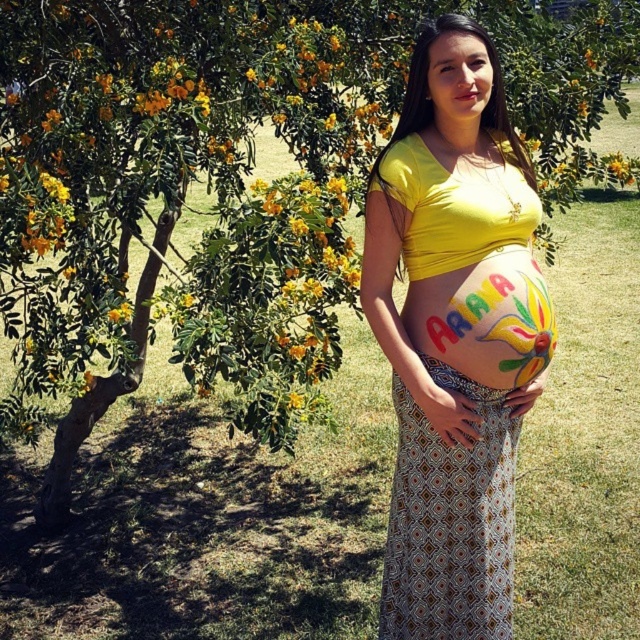
The width and height of the screenshot is (640, 640). In order to click on patterned fabric dress at center in this screenshot , I will do 451,520.

Is patterned fabric dress at center above painted colorful belly at center?

Incorrect, patterned fabric dress at center is not positioned above painted colorful belly at center.

The image size is (640, 640). What do you see at coordinates (451, 520) in the screenshot?
I see `patterned fabric dress at center` at bounding box center [451, 520].

You are a GUI agent. You are given a task and a screenshot of the screen. Output one action in this format:
    pyautogui.click(x=<x>, y=<y>)
    Task: Click on the patterned fabric dress at center
    
    Given the screenshot: What is the action you would take?
    pyautogui.click(x=451, y=520)

Is point (433, 541) behind point (474, 524)?

Yes, it is.

Which is in front, point (435, 266) or point (456, 381)?

Point (435, 266) is in front.

The height and width of the screenshot is (640, 640). I want to click on matte yellow shirt at center, so click(x=454, y=337).

Is matte yellow shirt at center to the left of painted colorful belly at center from the viewer's perspective?

Correct, you'll find matte yellow shirt at center to the left of painted colorful belly at center.

Looking at this image, who is more distant from viewer, (x=500, y=236) or (x=440, y=349)?

Point (x=440, y=349)

In order to click on matte yellow shirt at center in this screenshot , I will do `click(454, 337)`.